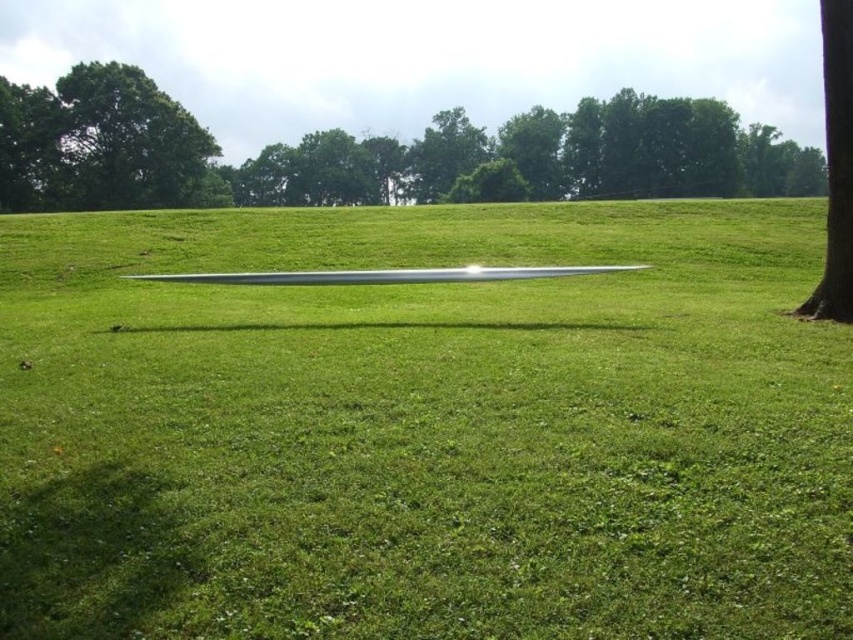
You are standing in the middle of the field and want to walk to both the point at coordinates point (80, 116) and point (834, 211). Which point will you reach first?

You will reach point (80, 116) first because it is closer to you than point (834, 211), which is further away.

You are standing in the middle of the grassy field and see the point marked at coordinates (834, 168). What object is located at that point?

The point at coordinates (834, 168) corresponds to the brown textured tree trunk at right.

You are a gardener who needs to place a new decorative rock between the brown textured tree trunk at right and the silver metallic blade at center. Based on their positions, where should you place the rock?

The brown textured tree trunk at right is to the right of the silver metallic blade at center, so you should place the decorative rock between them, closer to the silver metallic blade at center since the tree trunk is positioned further right.